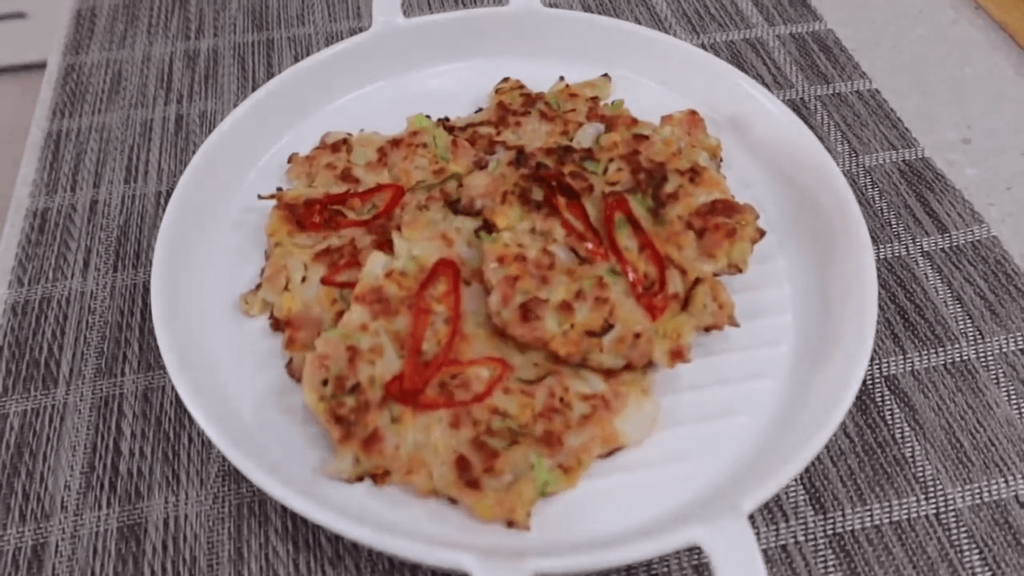
This screenshot has height=576, width=1024. Identify the location of white plate. (731, 393).